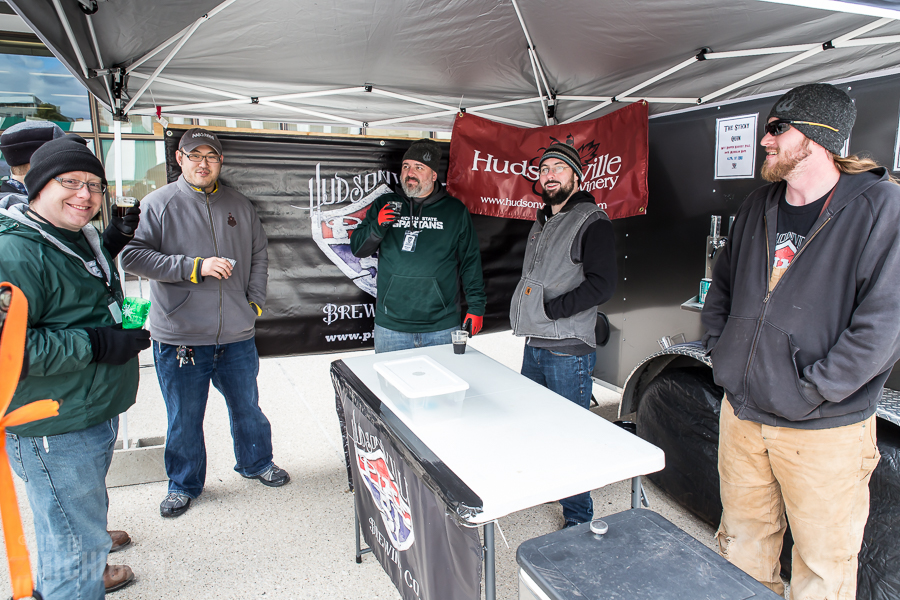
This screenshot has height=600, width=900. I want to click on table, so click(x=531, y=460).